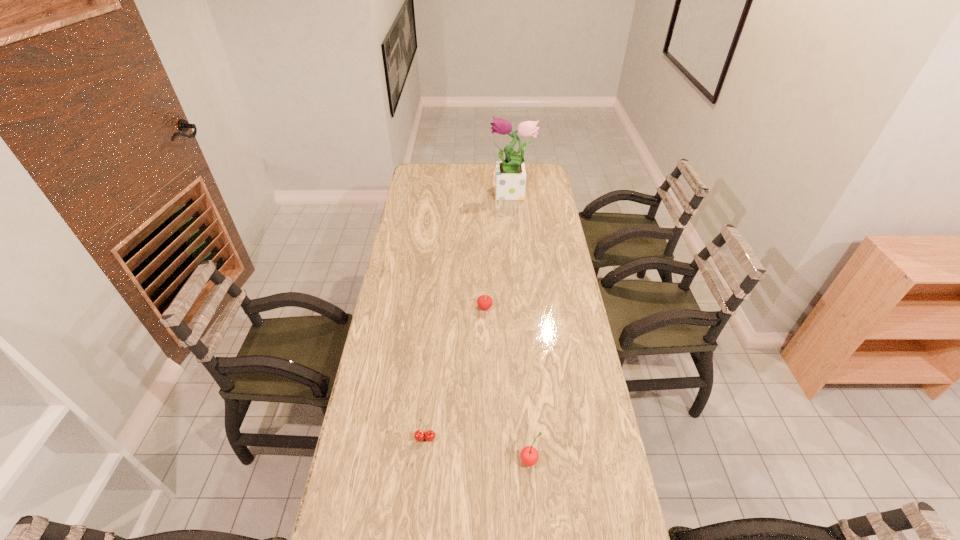
Locate an element on the screen. The height and width of the screenshot is (540, 960). free location at the far right corner is located at coordinates (549, 176).

Locate an element on the screen. free space that is in between the farthest object and the third farthest object is located at coordinates pos(468,316).

Locate an element on the screen. free space between the nearest object and the flower arrangement is located at coordinates (520, 327).

Locate an element on the screen. empty space between the second farthest cherry and the third nearest object is located at coordinates (455, 373).

Find the location of a particular element. The height and width of the screenshot is (540, 960). vacant area between the second farthest object and the tallest object is located at coordinates (498, 251).

You are a GUI agent. You are given a task and a screenshot of the screen. Output one action in this format:
    pyautogui.click(x=<x>, y=<y>)
    Task: Click on the vacant region between the farthest cherry and the leftmost cherry
    
    Given the screenshot: What is the action you would take?
    pyautogui.click(x=455, y=373)

You are a GUI agent. You are given a task and a screenshot of the screen. Output one action in this format:
    pyautogui.click(x=<x>, y=<y>)
    Task: Click on the empty space between the rightmost cherry and the farthest object
    This screenshot has height=540, width=960.
    Given the screenshot: What is the action you would take?
    pyautogui.click(x=520, y=327)

Image resolution: width=960 pixels, height=540 pixels. Identify the location of empty location between the farthest cherry and the flower arrangement. (498, 251).

I want to click on free space between the farthest object and the nearest object, so click(520, 327).

Locate an element on the screen. empty location between the shortest cherry and the farthest object is located at coordinates (468, 316).